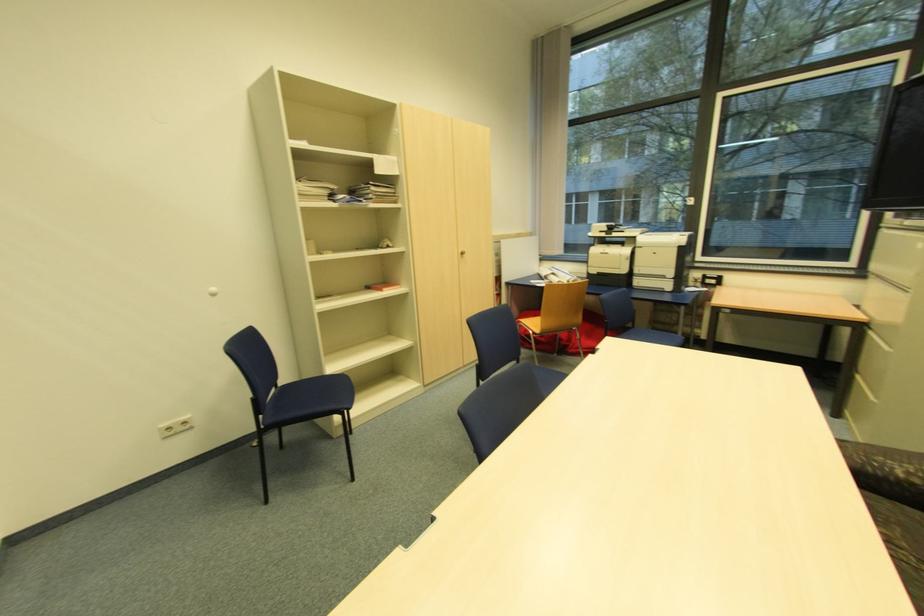
Locate an element on the screen. Image resolution: width=924 pixels, height=616 pixels. orange chair sitting surface is located at coordinates (529, 323).